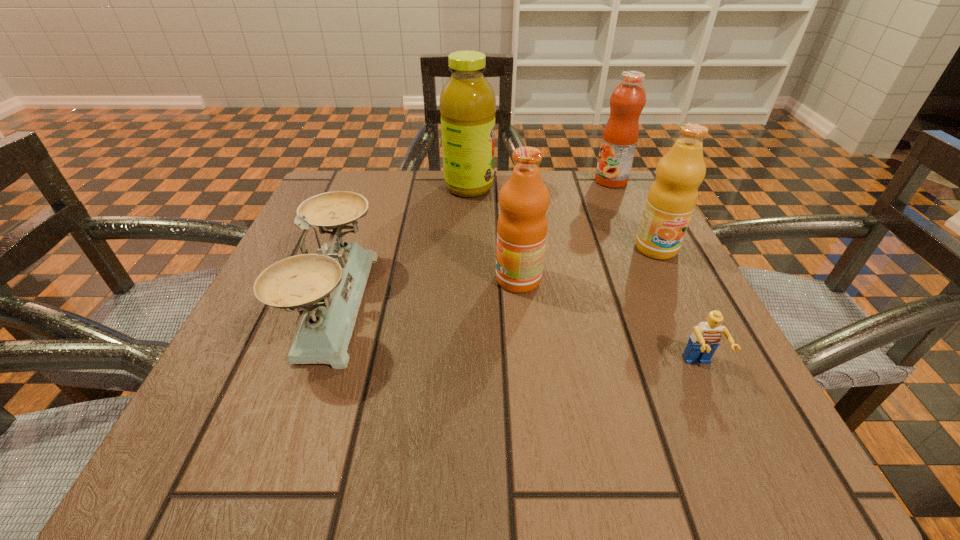
Where is `vacant space at the near right corner`? This screenshot has width=960, height=540. vacant space at the near right corner is located at coordinates (752, 409).

Where is `vacant point located between the nearest fruit juice and the leftmost object`? vacant point located between the nearest fruit juice and the leftmost object is located at coordinates (427, 291).

Image resolution: width=960 pixels, height=540 pixels. In order to click on free space between the shortest object and the nearest fruit juice in this screenshot , I will do `click(609, 323)`.

Where is `object that is the closest to the shortest object`? object that is the closest to the shortest object is located at coordinates (671, 200).

The image size is (960, 540). I want to click on the closest object relative to the Lego, so click(x=671, y=200).

You are a GUI agent. You are given a task and a screenshot of the screen. Output one action in this format:
    pyautogui.click(x=<x>, y=<y>)
    Task: Click on the fruit juice that is the nearest to the shortest object
    This screenshot has width=960, height=540.
    Given the screenshot: What is the action you would take?
    pyautogui.click(x=671, y=200)

Find the location of a particular element. This screenshot has width=960, height=540. fruit juice that is the third closest one to the scale is located at coordinates (671, 200).